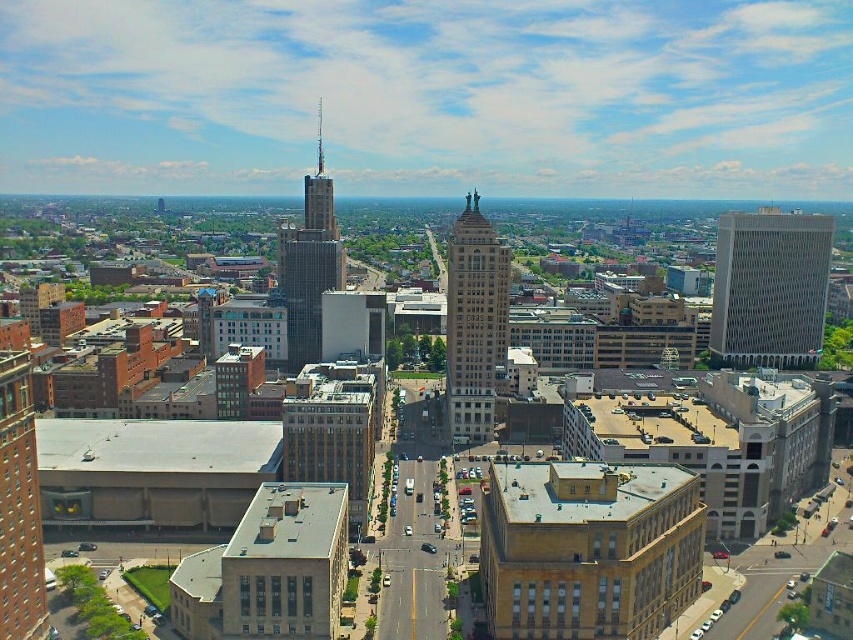
You are standing at the point with coordinates point (318,180) and want to look towards point (0,636). Which direction should you face?

Since point (0,636) is closer to the viewer than point (318,180), you should face towards the direction where the closer point is located, which would be towards the lower right side of your current position.

You are a drone operator flying a drone over the city. Your drone is currently at point [485,422]. You want to fly it to point [306,240]. Which direction should you move the drone to get closer to the destination?

Point [485,422] is closer to the viewer than point [306,240]. To reach the destination, you should move the drone away from the viewer towards point [306,240].